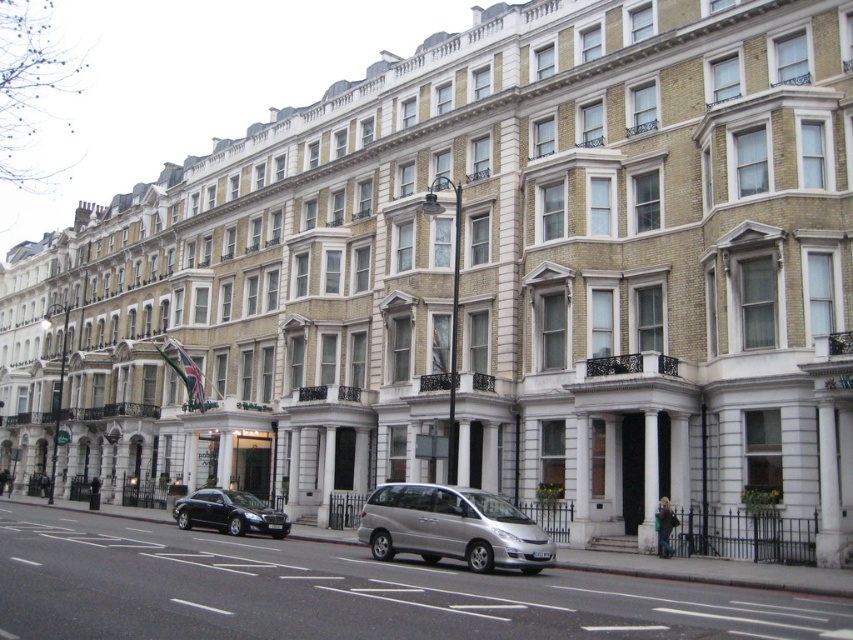
Question: Is silver metallic van at center wider than silver metallic minivan at center?

Choices:
 (A) no
 (B) yes

Answer: (B)

Question: Which is nearer to the shiny black sedan at lower left?

Choices:
 (A) silver metallic van at center
 (B) silver metallic minivan at center

Answer: (A)

Question: Is silver metallic minivan at center wider than shiny black sedan at lower left?

Choices:
 (A) yes
 (B) no

Answer: (B)

Question: Does silver metallic minivan at center have a greater width compared to shiny black sedan at lower left?

Choices:
 (A) yes
 (B) no

Answer: (B)

Question: Which object is closer to the camera taking this photo?

Choices:
 (A) silver metallic van at center
 (B) shiny black sedan at lower left
 (C) silver metallic minivan at center

Answer: (A)

Question: Among these points, which one is nearest to the camera?

Choices:
 (A) (47, 627)
 (B) (231, 499)
 (C) (372, 538)

Answer: (A)